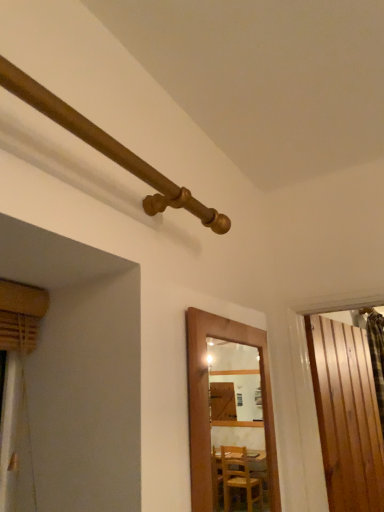
Question: Looking at their shapes, would you say wooden pipe at upper left is wider or thinner than wooden door at center, positioned as the second door in right-to-left order?

Choices:
 (A) thin
 (B) wide

Answer: (B)

Question: Considering their positions, is wooden pipe at upper left located in front of or behind wooden door at center, marked as the first door in a front-to-back arrangement?

Choices:
 (A) behind
 (B) front

Answer: (B)

Question: Which of these objects is positioned closest to the wooden pipe at upper left?

Choices:
 (A) wooden slats at right, the second door viewed from the front
 (B) wooden door at center, marked as the first door in a front-to-back arrangement

Answer: (B)

Question: Which object is the closest to the wooden pipe at upper left?

Choices:
 (A) wooden door at center, which appears as the 2th door when viewed from the back
 (B) wooden slats at right, positioned as the first door in right-to-left order

Answer: (A)